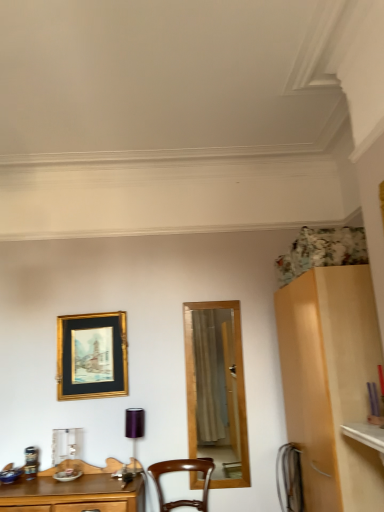
Question: In terms of height, does purple metallic lamp at center look taller or shorter compared to brown wooden chair at center?

Choices:
 (A) tall
 (B) short

Answer: (A)

Question: From the image's perspective, is purple metallic lamp at center located above or below brown wooden chair at center?

Choices:
 (A) below
 (B) above

Answer: (B)

Question: Based on their relative distances, which object is farther from the brown wooden chair at center?

Choices:
 (A) gold/glossy picture frame at upper left
 (B) purple metallic lamp at center

Answer: (A)

Question: Which object is positioned closest to the brown wooden chair at center?

Choices:
 (A) purple metallic lamp at center
 (B) gold/glossy picture frame at upper left

Answer: (A)